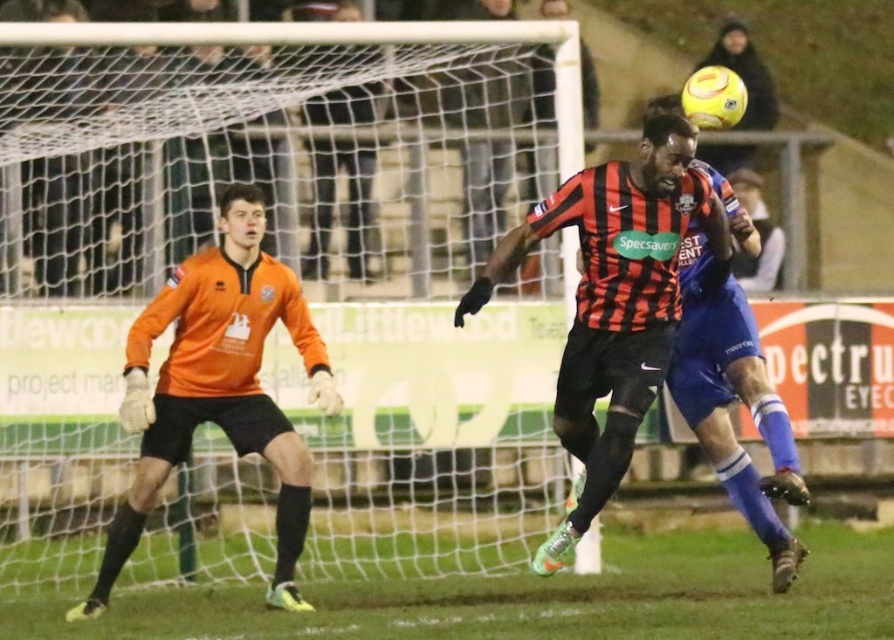
How much distance is there between red and black striped jersey at center and orange jersey at left?

red and black striped jersey at center is 2.03 meters away from orange jersey at left.

Is point (584, 216) closer to viewer compared to point (299, 324)?

Yes.

Where is `red and black striped jersey at center`? red and black striped jersey at center is located at coordinates (614, 301).

Based on the photo, does matte orange goalkeeper jersey at left appear under red and black striped jersey at center?

Incorrect, matte orange goalkeeper jersey at left is not positioned below red and black striped jersey at center.

Can you confirm if matte orange goalkeeper jersey at left is shorter than red and black striped jersey at center?

Yes.

Describe the element at coordinates (285, 276) in the screenshot. I see `matte orange goalkeeper jersey at left` at that location.

Find the location of a particular element. The width and height of the screenshot is (894, 640). matte orange goalkeeper jersey at left is located at coordinates (285, 276).

Is matte orange goalkeeper jersey at left thinner than orange jersey at left?

No, matte orange goalkeeper jersey at left is not thinner than orange jersey at left.

Measure the distance between point (x=342, y=412) and camera.

They are 11.12 meters apart.

Where is `matte orange goalkeeper jersey at left`? matte orange goalkeeper jersey at left is located at coordinates (285, 276).